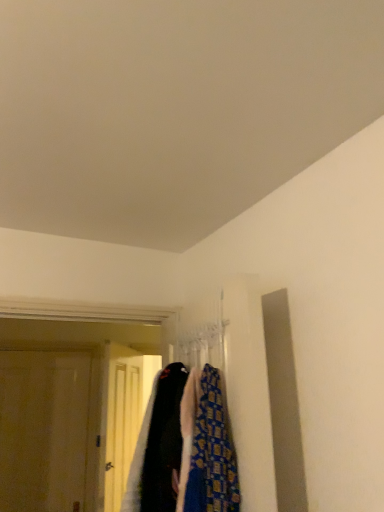
Question: Should I look upward or downward to see black fabric cloak at center?

Choices:
 (A) down
 (B) up

Answer: (A)